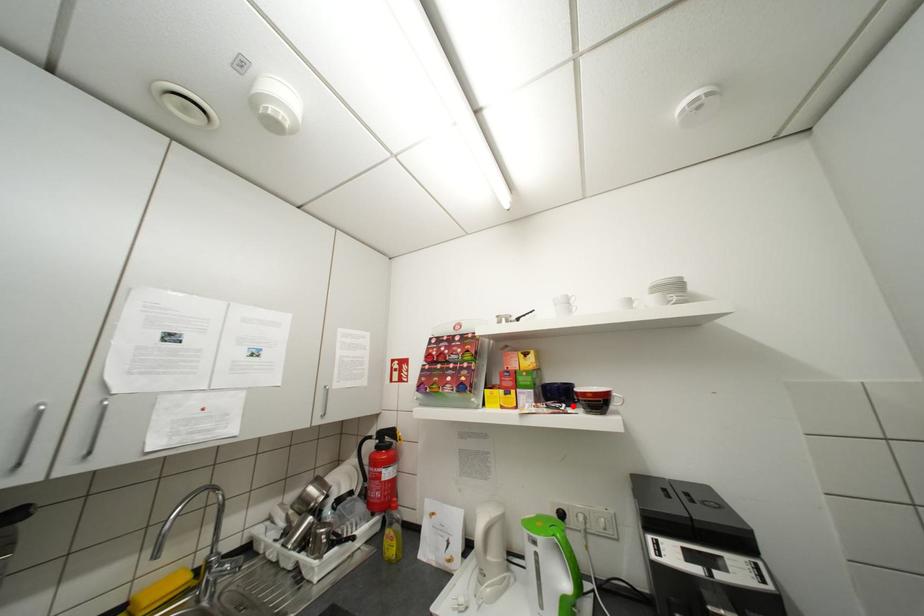
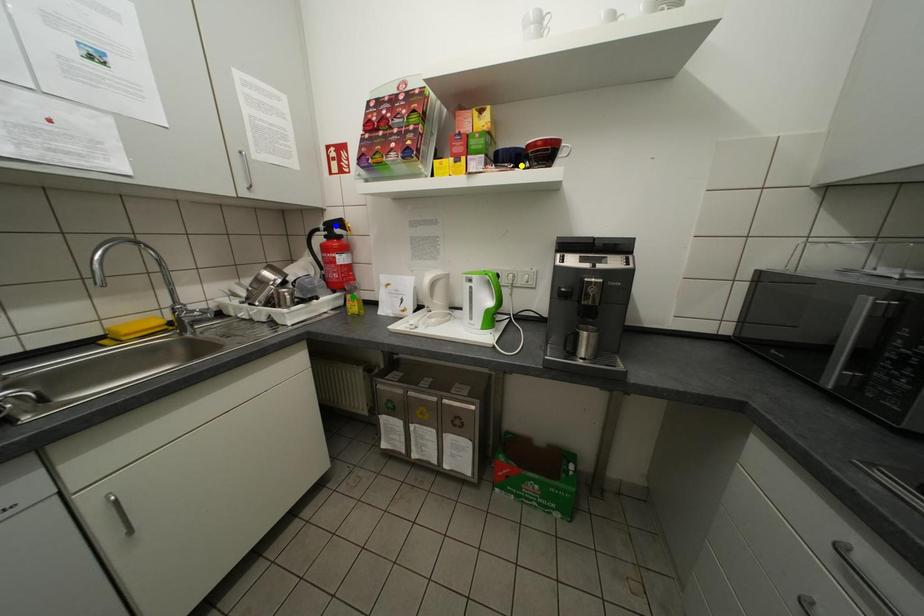
Question: I am providing you with two images of the same scene from different viewpoints. A red point is marked on the first image. You are given multiple points on the second image. In image 2, which mark is for the same physical point as the one in image 1?

Choices:
 (A) blue point
 (B) yellow point
 (C) green point

Answer: (B)